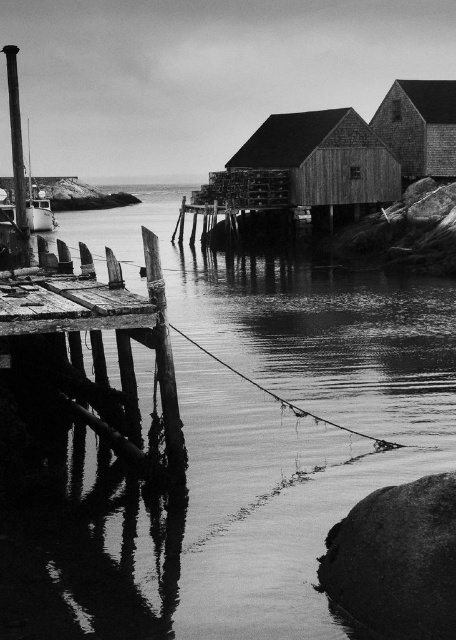
Which of these two, reflective wet wood at lower left or smooth wood pole at left, stands shorter?

Standing shorter between the two is reflective wet wood at lower left.

In the scene shown: Does reflective wet wood at lower left lie in front of smooth wood pole at left?

Yes, it is in front of smooth wood pole at left.

Does point (233, 308) lie behind point (10, 122)?

No, (233, 308) is in front of (10, 122).

Image resolution: width=456 pixels, height=640 pixels. In order to click on reflective wet wood at lower left in this screenshot , I will do `click(238, 445)`.

Does wooden hut at center have a smaller size compared to wooden cabin at upper right?

Yes.

Who is positioned more to the right, wooden hut at center or wooden cabin at upper right?

Positioned to the right is wooden cabin at upper right.

Is point (342, 112) farther from viewer compared to point (428, 99)?

That is False.

You are a GUI agent. You are given a task and a screenshot of the screen. Output one action in this format:
    pyautogui.click(x=<x>, y=<y>)
    Task: Click on the wooden hut at center
    This screenshot has height=640, width=456.
    Given the screenshot: What is the action you would take?
    pyautogui.click(x=312, y=164)

Who is more distant from viewer, (393, 464) or (450, 161)?

The point (450, 161) is more distant.

Does point (115, 536) come closer to viewer compared to point (418, 163)?

Yes, it is.

Where is `reflective wet wood at lower left`? reflective wet wood at lower left is located at coordinates (238, 445).